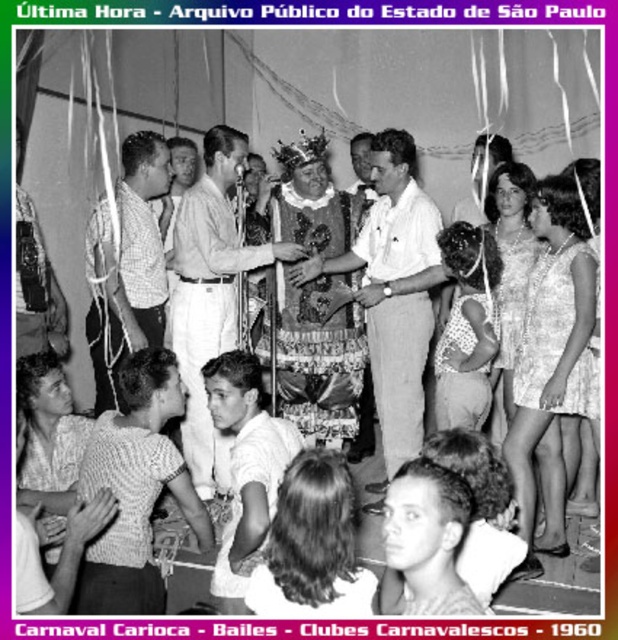
Is shiny metallic crown at center positioned behind checkered shirt at center?

No, it is not.

Is point (426, 268) closer to viewer compared to point (99, 387)?

That is True.

Who is more forward, (434, 280) or (99, 257)?

Positioned in front is point (99, 257).

Where is `shiny metallic crown at center`? shiny metallic crown at center is located at coordinates (394, 291).

Can you confirm if light brown cotton shirt at center is bigger than checkered shirt at center?

Yes, light brown cotton shirt at center is bigger than checkered shirt at center.

Which of these two, light brown cotton shirt at center or checkered shirt at center, stands taller?

With more height is light brown cotton shirt at center.

Where is `light brown cotton shirt at center`? light brown cotton shirt at center is located at coordinates (210, 296).

Does shiny metallic crown at center have a lesser height compared to white lace dress at center?

In fact, shiny metallic crown at center may be taller than white lace dress at center.

Who is positioned more to the left, shiny metallic crown at center or white lace dress at center?

Positioned to the left is shiny metallic crown at center.

Between point (412, 172) and point (459, 227), which one is positioned in front?

Positioned in front is point (459, 227).

The width and height of the screenshot is (618, 640). I want to click on shiny metallic crown at center, so click(394, 291).